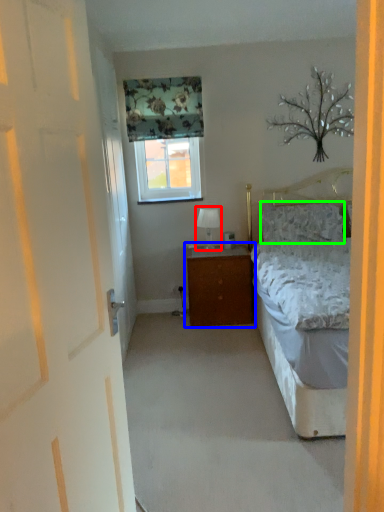
Question: Which object is positioned farthest from table lamp (highlighted by a red box)? Select from nightstand (highlighted by a blue box) and pillow (highlighted by a green box).

Choices:
 (A) nightstand
 (B) pillow

Answer: (B)